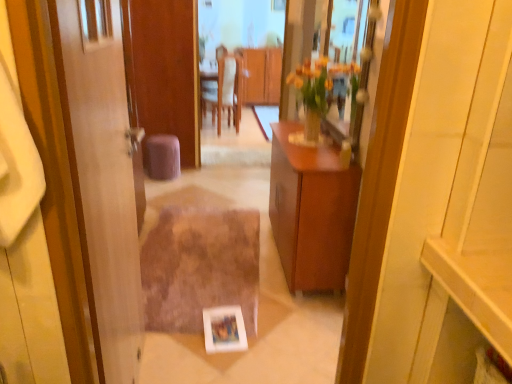
Measure the distance between point [248,17] and camera.

A distance of 20.06 feet exists between point [248,17] and camera.

Where is `wooden cabinet at center, the 1th cabinetry viewed from the top`? This screenshot has height=384, width=512. wooden cabinet at center, the 1th cabinetry viewed from the top is located at coordinates (259, 76).

Based on the photo, measure the distance between wooden door at left and camera.

A: They are 33.62 inches apart.

Measure the distance between brown shaggy rug at center and camera.

brown shaggy rug at center is 7.22 feet away from camera.

Find the location of `purple fabric stool at center`. purple fabric stool at center is located at coordinates (162, 157).

Image resolution: width=512 pixels, height=384 pixels. Identify the location of wooden table at center, the 2th mirror viewed from the front. (242, 57).

Can you confirm if wooden cabinet at center, placed as the 2th cabinetry when sorted from back to front, is wider than wooden door at left?

Yes, wooden cabinet at center, placed as the 2th cabinetry when sorted from back to front, is wider than wooden door at left.

From the image's perspective, is wooden cabinet at center, placed as the 2th cabinetry when sorted from back to front, on wooden door at left?

Indeed, from the image's perspective, wooden cabinet at center, placed as the 2th cabinetry when sorted from back to front, is shown above wooden door at left.

From a real-world perspective, which is physically below, wooden cabinet at center, placed as the first cabinetry when sorted from bottom to top, or wooden door at left?

wooden cabinet at center, placed as the first cabinetry when sorted from bottom to top.

I want to click on mirror on the right of the wooden table at center, the 2th mirror positioned from the right, so click(348, 32).

From a real-world perspective, is clear glass mirror at upper center, the first mirror positioned from the right, positioned under wooden table at center, which is counted as the first mirror, starting from the left, based on gravity?

No, from a real-world perspective, clear glass mirror at upper center, the first mirror positioned from the right, is not beneath wooden table at center, which is counted as the first mirror, starting from the left.

In the image, is clear glass mirror at upper center, placed as the 1th mirror when sorted from front to back, positioned in front of or behind wooden table at center, which is the 1th mirror in back-to-front order?

In the image, clear glass mirror at upper center, placed as the 1th mirror when sorted from front to back, appears in front of wooden table at center, which is the 1th mirror in back-to-front order.

Is the surface of clear glass mirror at upper center, placed as the second mirror when sorted from left to right, in direct contact with wooden table at center, which is counted as the first mirror, starting from the left?

clear glass mirror at upper center, placed as the second mirror when sorted from left to right, is not next to wooden table at center, which is counted as the first mirror, starting from the left, and they're not touching.

Considering the relative sizes of wooden table at center, the 2th mirror positioned from the right, and brown shaggy rug at center in the image provided, is wooden table at center, the 2th mirror positioned from the right, bigger than brown shaggy rug at center?

Indeed, wooden table at center, the 2th mirror positioned from the right, has a larger size compared to brown shaggy rug at center.

Does point (251, 46) come in front of point (147, 312)?

No, (251, 46) is behind (147, 312).

Find the location of `plain on the left side of wooden table at center, which is counted as the first mirror, starting from the left`. plain on the left side of wooden table at center, which is counted as the first mirror, starting from the left is located at coordinates (200, 267).

Which is more to the right, brown shaggy rug at center or wooden table at center, the 2th mirror positioned from the right?

From the viewer's perspective, wooden table at center, the 2th mirror positioned from the right, appears more on the right side.

Based on the photo, considering the relative sizes of brown shaggy rug at center and wooden table at center, the 2th mirror positioned from the right, in the image provided, is brown shaggy rug at center smaller than wooden table at center, the 2th mirror positioned from the right,?

Yes, brown shaggy rug at center is smaller than wooden table at center, the 2th mirror positioned from the right.

Consider the image. Considering the sizes of objects brown shaggy rug at center and wooden table at center, which is the 1th mirror in back-to-front order, in the image provided, who is wider, brown shaggy rug at center or wooden table at center, which is the 1th mirror in back-to-front order,?

With larger width is brown shaggy rug at center.

Which is less distant, [199,305] or [266,71]?

Point [199,305] is closer to the camera than point [266,71].

Is wooden cabinet at center, which is the second cabinetry in front-to-back order, facing towards wooden cabinet at center, placed as the 2th cabinetry when sorted from back to front?

Yes, wooden cabinet at center, which is the second cabinetry in front-to-back order, is turned towards wooden cabinet at center, placed as the 2th cabinetry when sorted from back to front.

Considering the sizes of objects wooden cabinet at center, the 1th cabinetry viewed from the top, and wooden cabinet at center, the 1th cabinetry when ordered from front to back, in the image provided, who is smaller, wooden cabinet at center, the 1th cabinetry viewed from the top, or wooden cabinet at center, the 1th cabinetry when ordered from front to back,?

wooden cabinet at center, the 1th cabinetry viewed from the top, is smaller.

Between wooden cabinet at center, which is the second cabinetry in front-to-back order, and wooden cabinet at center, placed as the 2th cabinetry when sorted from back to front, which one has smaller width?

With smaller width is wooden cabinet at center, which is the second cabinetry in front-to-back order.

Is wooden cabinet at center, placed as the second cabinetry when sorted from bottom to top, outside of wooden cabinet at center, placed as the first cabinetry when sorted from bottom to top?

Result: Indeed, wooden cabinet at center, placed as the second cabinetry when sorted from bottom to top, is completely outside wooden cabinet at center, placed as the first cabinetry when sorted from bottom to top.

Who is shorter, wooden cabinet at center, placed as the first cabinetry when sorted from bottom to top, or clear glass mirror at upper center, placed as the second mirror when sorted from left to right?

Standing shorter between the two is clear glass mirror at upper center, placed as the second mirror when sorted from left to right.

Is clear glass mirror at upper center, which is the 2th mirror from back to front, at the back of wooden cabinet at center, placed as the 2th cabinetry when sorted from back to front?

No, wooden cabinet at center, placed as the 2th cabinetry when sorted from back to front, is not facing away from clear glass mirror at upper center, which is the 2th mirror from back to front.

In the scene shown: Which object is thinner, wooden cabinet at center, placed as the first cabinetry when sorted from bottom to top, or clear glass mirror at upper center, the first mirror positioned from the right?

Thinner between the two is clear glass mirror at upper center, the first mirror positioned from the right.

From a real-world perspective, is wooden cabinet at center, placed as the 2th cabinetry when sorted from back to front, located higher than clear glass mirror at upper center, placed as the 1th mirror when sorted from front to back?

No, from a real-world perspective, wooden cabinet at center, placed as the 2th cabinetry when sorted from back to front, is not above clear glass mirror at upper center, placed as the 1th mirror when sorted from front to back.

Locate an element on the screen. This screenshot has width=512, height=384. the 1st cabinetry counting from the right side of the wooden table at center, which is the 1th mirror in back-to-front order is located at coordinates (259, 76).

Between wooden table at center, the 2th mirror viewed from the front, and wooden cabinet at center, which is the second cabinetry in front-to-back order, which one has more height?

wooden table at center, the 2th mirror viewed from the front, is taller.

Is wooden table at center, which is counted as the first mirror, starting from the left, bigger or smaller than wooden cabinet at center, which is the second cabinetry in front-to-back order?

Considering their sizes, wooden table at center, which is counted as the first mirror, starting from the left, takes up less space than wooden cabinet at center, which is the second cabinetry in front-to-back order.

You are a GUI agent. You are given a task and a screenshot of the screen. Output one action in this format:
    pyautogui.click(x=<x>, y=<y>)
    Task: Click on the door in front of the wooden cabinet at center, placed as the 2th cabinetry when sorted from back to front
    The height and width of the screenshot is (384, 512).
    Given the screenshot: What is the action you would take?
    pyautogui.click(x=103, y=176)

The image size is (512, 384). Find the location of `mirror below the clear glass mirror at upper center, which is the 2th mirror from back to front (from a real-world perspective)`. mirror below the clear glass mirror at upper center, which is the 2th mirror from back to front (from a real-world perspective) is located at coordinates (242, 57).

Considering their positions, is wooden cabinet at center, positioned as the 1th cabinetry in back-to-front order, positioned further to wooden cabinet at center, placed as the 2th cabinetry when sorted from back to front, than clear glass mirror at upper center, the first mirror positioned from the right?

wooden cabinet at center, positioned as the 1th cabinetry in back-to-front order, lies further to wooden cabinet at center, placed as the 2th cabinetry when sorted from back to front, than the other object.

From the image, which object appears to be farther from purple fabric stool at center, wooden door at left or clear glass mirror at upper center, placed as the 1th mirror when sorted from front to back?

wooden door at left is further to purple fabric stool at center.

Based on their spatial positions, is wooden cabinet at center, placed as the second cabinetry when sorted from bottom to top, or purple fabric stool at center further from clear glass mirror at upper center, placed as the 1th mirror when sorted from front to back?

Based on the image, wooden cabinet at center, placed as the second cabinetry when sorted from bottom to top, appears to be further to clear glass mirror at upper center, placed as the 1th mirror when sorted from front to back.

Estimate the real-world distances between objects in this image. Which object is closer to brown shaggy rug at center, wooden table at center, the 2th mirror viewed from the front, or wooden cabinet at center, positioned as the 1th cabinetry in back-to-front order?

The object closer to brown shaggy rug at center is wooden table at center, the 2th mirror viewed from the front.

Considering their positions, is wooden cabinet at center, the 1th cabinetry viewed from the top, positioned closer to clear glass mirror at upper center, placed as the 1th mirror when sorted from front to back, than brown shaggy rug at center?

brown shaggy rug at center.

Which object lies nearer to the anchor point wooden cabinet at center, positioned as the 1th cabinetry in back-to-front order, white leather chair at center or wooden door at left?

white leather chair at center is positioned closer to the anchor wooden cabinet at center, positioned as the 1th cabinetry in back-to-front order.

Looking at the image, which one is located closer to clear glass mirror at upper center, which is the 2th mirror from back to front, purple fabric stool at center or white leather chair at center?

purple fabric stool at center.

Based on the photo, from the image, which object appears to be farther from wooden table at center, which is counted as the first mirror, starting from the left, purple fabric stool at center or wooden cabinet at center, placed as the 2th cabinetry when sorted from back to front?

Among the two, wooden cabinet at center, placed as the 2th cabinetry when sorted from back to front, is located further to wooden table at center, which is counted as the first mirror, starting from the left.

This screenshot has width=512, height=384. I want to click on mirror between brown shaggy rug at center and purple fabric stool at center from front to back, so click(x=242, y=57).

Find the location of a particular element. Image resolution: width=512 pixels, height=384 pixels. cabinetry between clear glass mirror at upper center, the first mirror positioned from the right, and white leather chair at center, along the z-axis is located at coordinates (311, 211).

Locate an element on the screen. The height and width of the screenshot is (384, 512). stool positioned between wooden door at left and wooden cabinet at center, which is the second cabinetry in front-to-back order, from near to far is located at coordinates (162, 157).

Identify the location of stool between brown shaggy rug at center and wooden cabinet at center, placed as the second cabinetry when sorted from bottom to top, from front to back. The width and height of the screenshot is (512, 384). (162, 157).